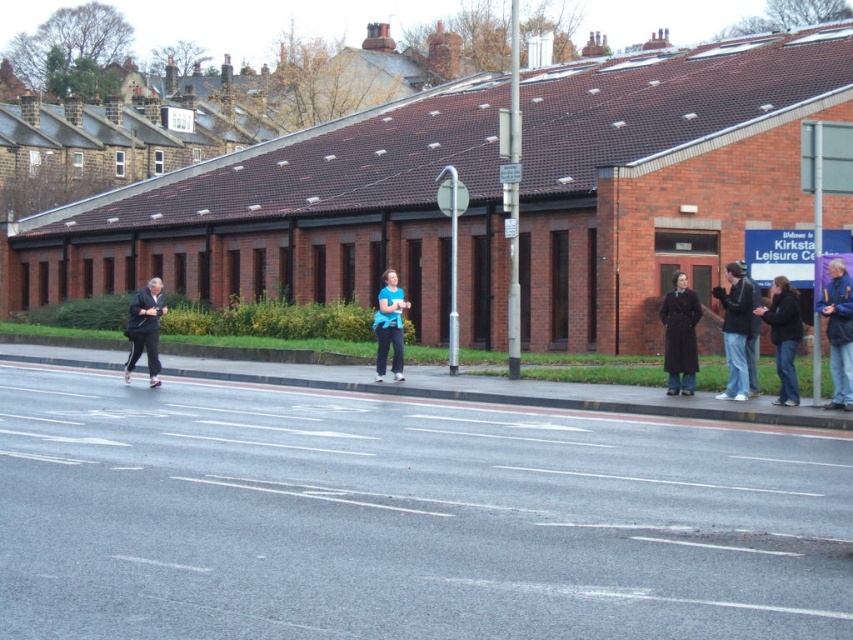
A pedestrian is running across a busy road in an urban area. There are two people visible in the scene. One is wearing a dark blue jacket at right. The other is a person dressed in dark clothing. How far apart are these two individuals?

The dark blue jacket at right and the person dressed in dark clothing are 56.30 feet apart.

You are a pedestrian standing at the left side of the road. You see a person running from left to right across the road and a person wearing dark blue jeans at right. How far apart are these two people?

The two people are 17.88 meters apart.

You are a delivery drone operator who needs to fly a package from the dark gray track pants at left to the dark blue jeans at right. The drone has a maximum flight range of 10 meters. Can the drone make the delivery without needing to recharge?

The distance between dark blue jeans at right and dark gray track pants at left is 9.68 meters, so yes, the drone can make the delivery without needing to recharge since the distance is within its 10 meter range.